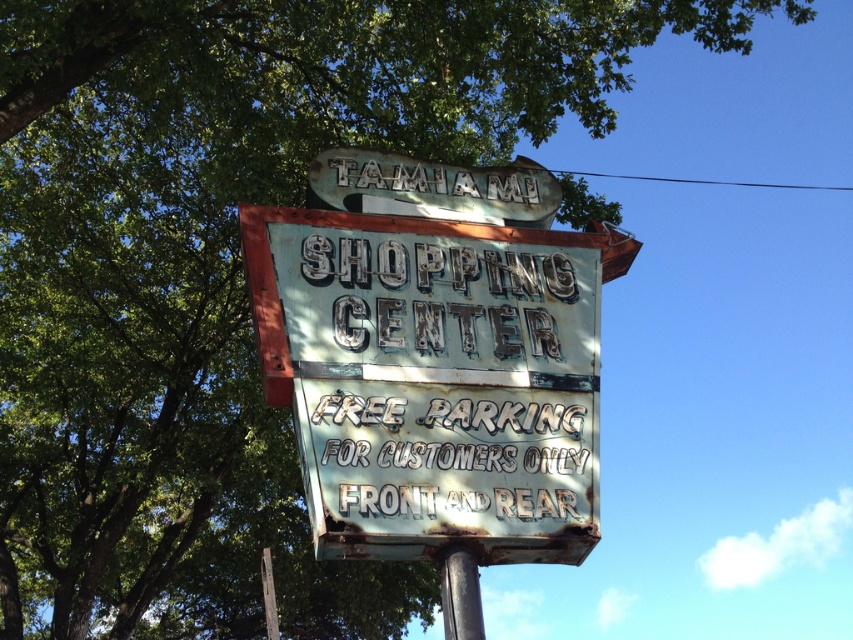
Question: Does rusty metal sign at center have a greater width compared to rusty metal pole at lower center?

Choices:
 (A) no
 (B) yes

Answer: (B)

Question: Which point is closer to the camera?

Choices:
 (A) rusty metal sign at center
 (B) rusty metal pole at lower center

Answer: (A)

Question: Does rusty metal sign at center have a smaller size compared to rusty metal pole at lower center?

Choices:
 (A) yes
 (B) no

Answer: (B)

Question: Which point appears farthest from the camera in this image?

Choices:
 (A) (469, 580)
 (B) (322, 547)

Answer: (A)

Question: Observing the image, what is the correct spatial positioning of rusty metal sign at center in reference to rusty metal pole at lower center?

Choices:
 (A) below
 (B) above

Answer: (B)